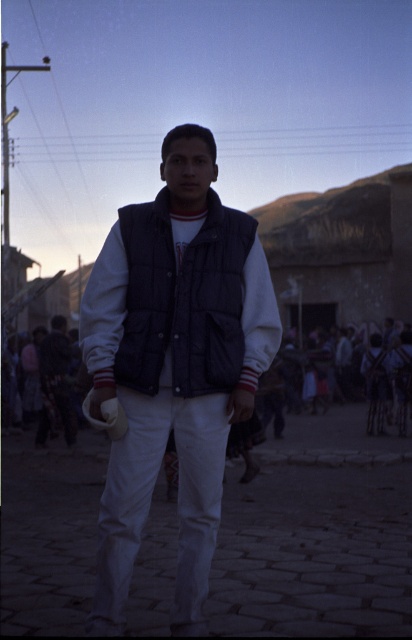
Who is lower down, matte blue vest at center or dark blue denim vest at center?

dark blue denim vest at center is below.

Locate an element on the screen. matte blue vest at center is located at coordinates (171, 364).

I want to click on matte blue vest at center, so pos(171,364).

Between matte blue vest at center and dark blue quilted vest at center, which one is positioned lower?

matte blue vest at center is lower down.

From the picture: Who is taller, matte blue vest at center or dark blue quilted vest at center?

matte blue vest at center

Describe the element at coordinates (171, 364) in the screenshot. I see `matte blue vest at center` at that location.

The height and width of the screenshot is (640, 412). I want to click on matte blue vest at center, so click(171, 364).

Is white cotton crowd at center below dark blue denim vest at center?

Indeed, white cotton crowd at center is positioned under dark blue denim vest at center.

Between white cotton crowd at center and dark blue denim vest at center, which one is positioned lower?

white cotton crowd at center is below.

Does point (287, 448) lie behind point (65, 358)?

That is False.

The height and width of the screenshot is (640, 412). I want to click on white cotton crowd at center, so click(x=336, y=432).